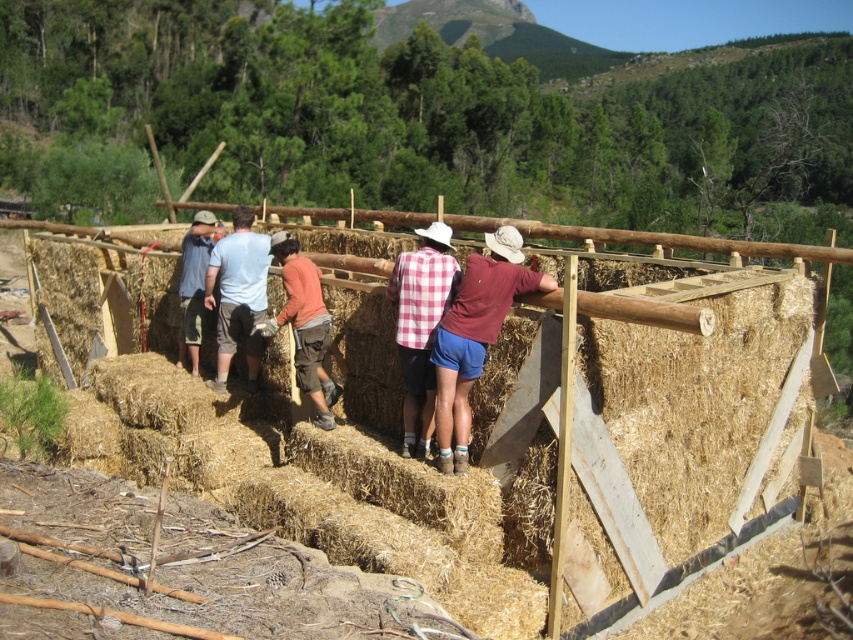
Question: Among these objects, which one is nearest to the camera?

Choices:
 (A) plaid fabric shirt at center
 (B) blue denim jeans at center
 (C) natural straw bales at center

Answer: (C)

Question: Does maroon fabric shirt at center have a greater width compared to blue denim jeans at center?

Choices:
 (A) yes
 (B) no

Answer: (A)

Question: Is plaid fabric shirt at center thinner than light blue cotton shirt at center?

Choices:
 (A) yes
 (B) no

Answer: (A)

Question: Which point is closer to the camera?

Choices:
 (A) (537, 273)
 (B) (248, 332)
 (C) (187, 250)

Answer: (A)

Question: Is the position of natural straw bales at center less distant than that of orange shirt at center?

Choices:
 (A) yes
 (B) no

Answer: (A)

Question: Which point appears farthest from the camera in this image?

Choices:
 (A) (326, 433)
 (B) (412, 369)

Answer: (A)